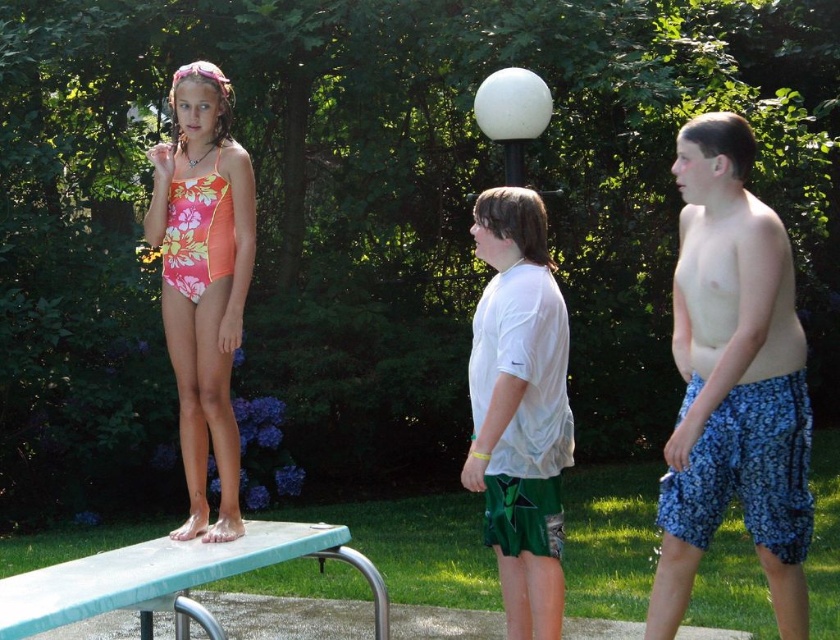
Question: Estimate the real-world distances between objects in this image. Which object is farther from the white matte shirt at center?

Choices:
 (A) floral print swimsuit at center
 (B) green metallic rail at lower left

Answer: (A)

Question: From the image, what is the correct spatial relationship of floral print swimsuit at center in relation to green metallic rail at lower left?

Choices:
 (A) right
 (B) left

Answer: (B)

Question: Among these objects, which one is farthest from the camera?

Choices:
 (A) blue floral shorts at right
 (B) green metallic rail at lower left

Answer: (A)

Question: Is white matte shirt at center thinner than floral print swimsuit at center?

Choices:
 (A) yes
 (B) no

Answer: (A)

Question: Which point is closer to the camera taking this photo?

Choices:
 (A) (232, 202)
 (B) (549, 564)

Answer: (B)

Question: Is white matte shirt at center thinner than green metallic rail at lower left?

Choices:
 (A) yes
 (B) no

Answer: (A)